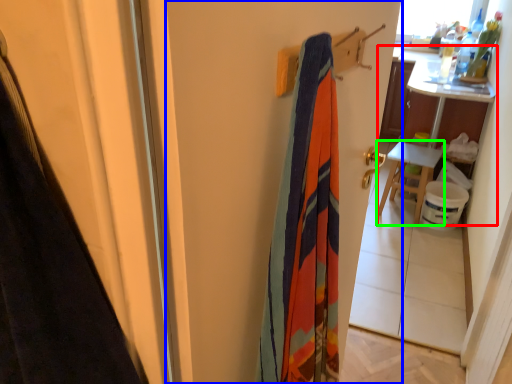
Question: Which is nearer to the table (highlighted by a red box)? screen door (highlighted by a blue box) or furniture (highlighted by a green box).

Choices:
 (A) screen door
 (B) furniture

Answer: (B)